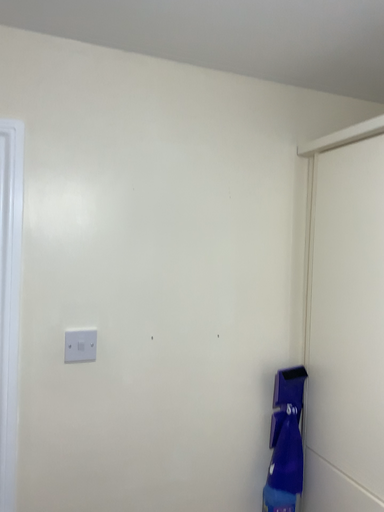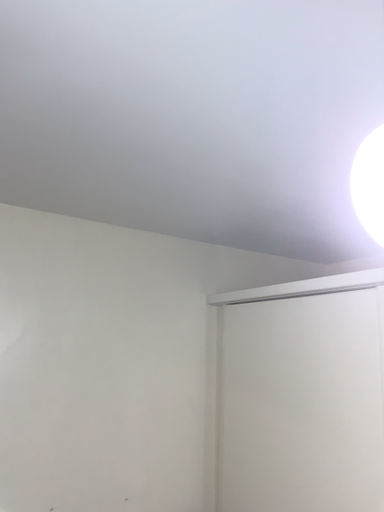
Question: Which way did the camera rotate in the video?

Choices:
 (A) rotated upward
 (B) rotated downward

Answer: (A)